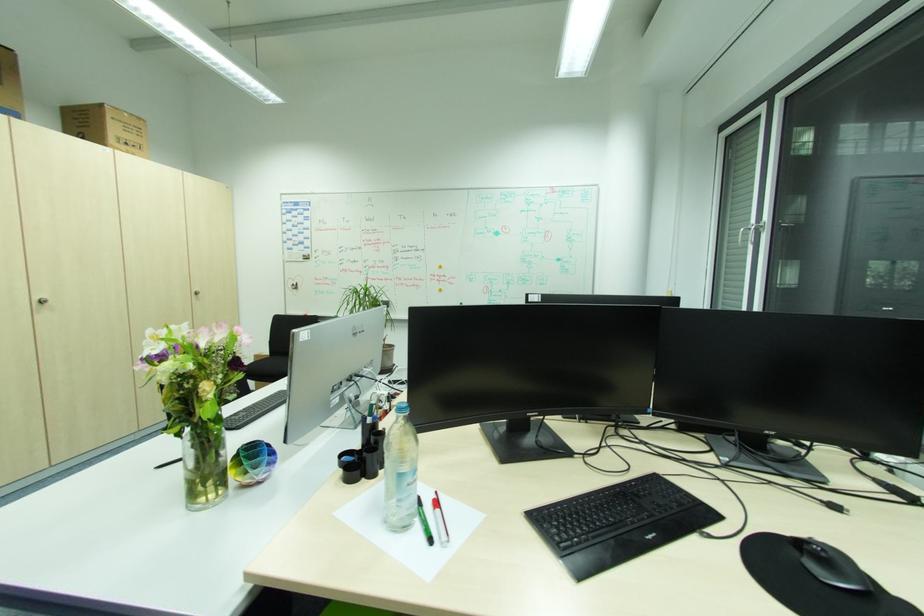
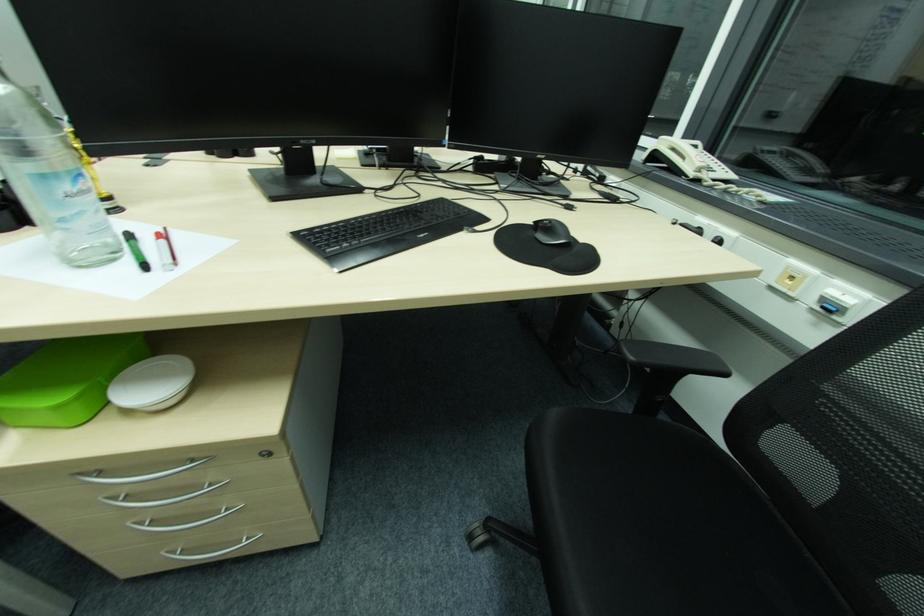
Based on the continuous images, in which direction is the camera rotating?

The camera rotated toward right-down.